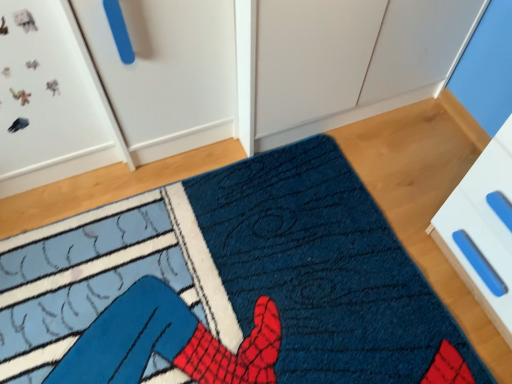
This screenshot has width=512, height=384. I want to click on free location above textured blue rug at center (from a real-world perspective), so click(x=239, y=281).